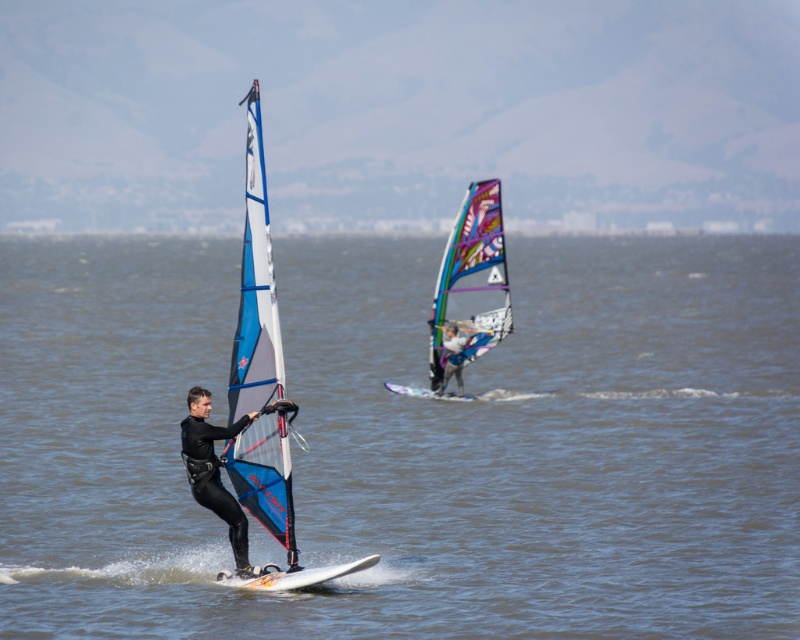
Is clear blue water at center below matte blue sail at center?

Incorrect, clear blue water at center is not positioned below matte blue sail at center.

Which is behind, point (120, 545) or point (449, 369)?

Positioned behind is point (449, 369).

This screenshot has height=640, width=800. I want to click on clear blue water at center, so click(x=410, y=440).

The image size is (800, 640). Describe the element at coordinates (410, 440) in the screenshot. I see `clear blue water at center` at that location.

I want to click on clear blue water at center, so click(x=410, y=440).

The width and height of the screenshot is (800, 640). I want to click on clear blue water at center, so click(x=410, y=440).

Is blue/white sail at center below multicolored mesh sail at center?

Correct, blue/white sail at center is located below multicolored mesh sail at center.

Where is `blue/white sail at center`? Image resolution: width=800 pixels, height=640 pixels. blue/white sail at center is located at coordinates (256, 289).